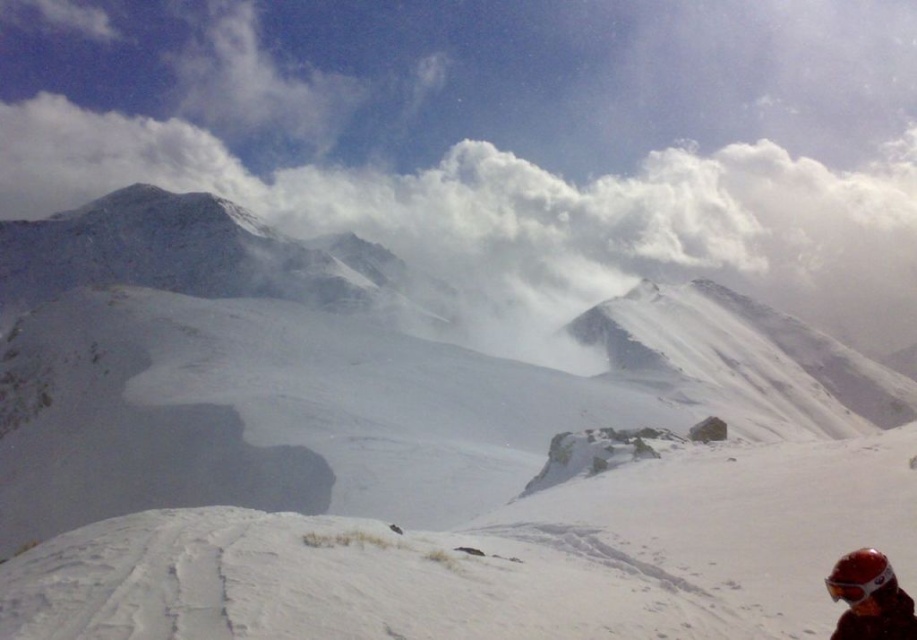
You are a photographer trying to capture the matte red goggles at lower right in your shot. There is a white fluffy cloud at upper center that might block the view. Based on their positions, will the cloud interfere with your photo of the goggles?

The white fluffy cloud at upper center is further to the viewer than the matte red goggles at lower right, so the cloud will not block the goggles in your photo.

You are a drone operator trying to capture a photo of the white fluffy cloud at upper center. The drone is currently at the point marked as point [534,216]. Can you confirm if the drone is already positioned directly above the white fluffy cloud at upper center?

The point [534,216] is the location of the white fluffy cloud at upper center, so yes, the drone is positioned directly above the white fluffy cloud at upper center.